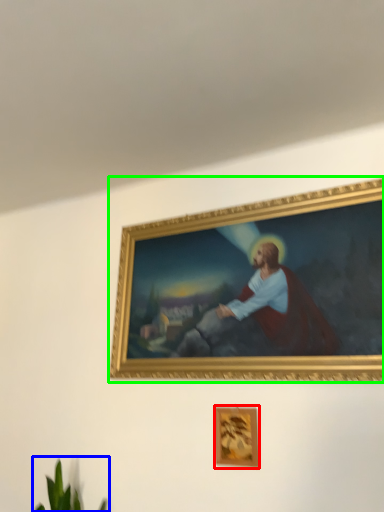
Question: Estimate the real-world distances between objects in this image. Which object is farther from picture frame (highlighted by a red box), plant (highlighted by a blue box) or picture frame (highlighted by a green box)?

Choices:
 (A) plant
 (B) picture frame

Answer: (A)